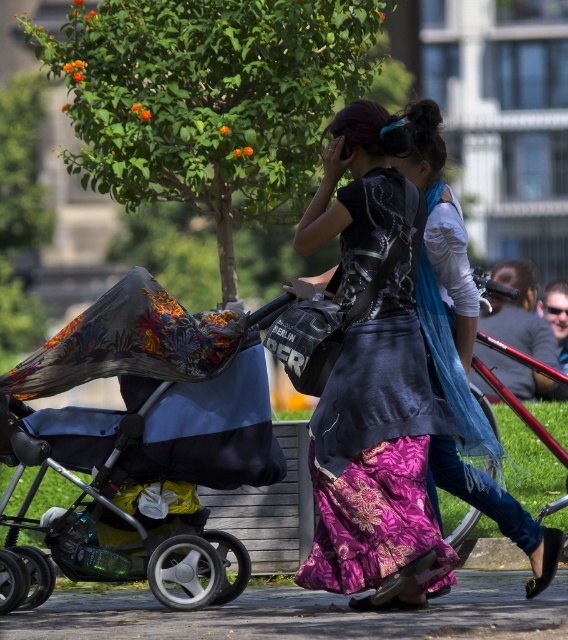
Does blue fabric stroller at left have a lesser height compared to matte black jacket at center?

Correct, blue fabric stroller at left is not as tall as matte black jacket at center.

What do you see at coordinates (145, 440) in the screenshot? This screenshot has width=568, height=640. I see `blue fabric stroller at left` at bounding box center [145, 440].

Where is `blue fabric stroller at left`? blue fabric stroller at left is located at coordinates (145, 440).

Measure the distance between point (327, 460) and camera.

Point (327, 460) is 12.25 meters away from camera.

Is matte black top at center positioned behind paved concrete pavement at lower center?

That is True.

Is point (415, 593) positioned before point (261, 593)?

Yes.

This screenshot has height=640, width=568. Find the location of `matte black top at center`. matte black top at center is located at coordinates (378, 451).

Does blue fabric stroller at left appear on the right side of paved concrete pavement at lower center?

No, blue fabric stroller at left is not to the right of paved concrete pavement at lower center.

Is point (28, 392) in front of point (23, 632)?

No, (28, 392) is behind (23, 632).

Identify the location of blue fabric stroller at left. (145, 440).